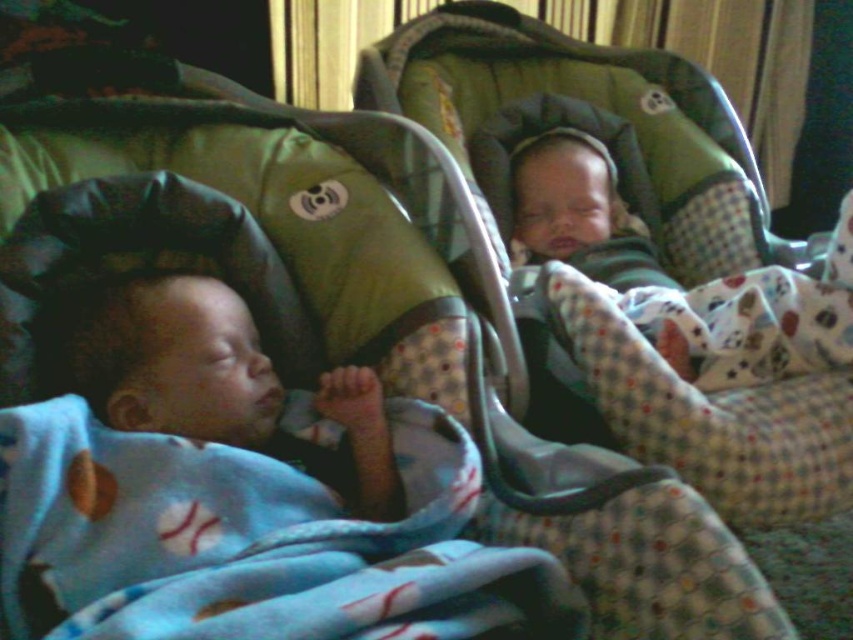
You are a parent trying to cover your baby with the blue fleece blanket at lower left. The baby is currently lying on the bed. Based on the blanket location, can you reach it without moving from your current position?

The blue fleece blanket at lower left is located at point (244, 547), which is within a typical arm reach for an adult standing or sitting near the bed. Therefore, you can likely reach the blue fleece blanket at lower left without needing to move your position.

You are a parent checking on your sleeping babies. You notice the blue fleece blanket at lower left and the soft blue blanket at left. Which blanket is positioned lower in the image?

The blue fleece blanket at lower left is located below the soft blue blanket at left, so it is positioned lower in the image.

You are a parent checking on your sleeping babies. You see the blue fleece blanket at lower left and the soft blue blanket at left. Which blanket is closer to the middle of the room?

The blue fleece blanket at lower left is closer to the middle of the room because it is positioned to the right of the soft blue blanket at left, placing it nearer to the center.